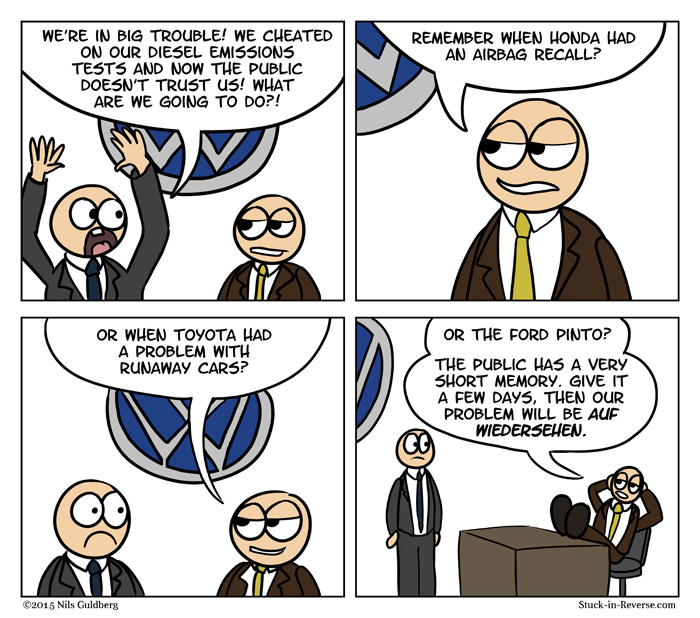
Identify the location of desk. tap(505, 555).